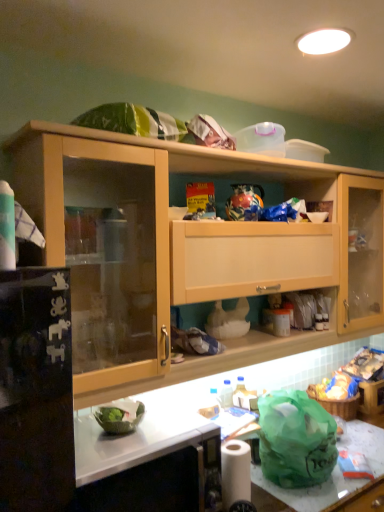
Image resolution: width=384 pixels, height=512 pixels. Identify the location of vacant space situated above white glossy countertop at lower center, which ranks as the first counter top in left-to-right order (from a real-world perspective). (119, 445).